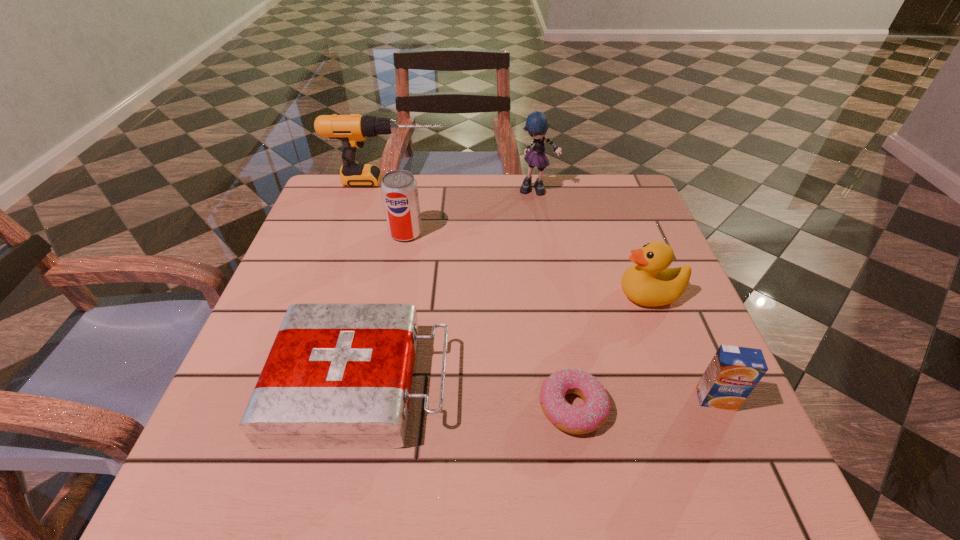
The width and height of the screenshot is (960, 540). I want to click on vacant space that is in between the drill and the rag doll, so click(463, 185).

This screenshot has width=960, height=540. What are the coordinates of `the fourth closest object to the doughnut` in the screenshot? It's located at (399, 189).

At what (x,y) coordinates should I click in order to perform the action: click on the sixth closest object to the first-aid kit. Please return your answer as a coordinate pair (x, y). This screenshot has width=960, height=540. Looking at the image, I should click on (352, 130).

What are the coordinates of `free spot that satisfies the following two spatial constraints: 1. at the beak of the fourth nearest object; 2. on the front side of the doughnut` in the screenshot? It's located at [x=693, y=408].

The width and height of the screenshot is (960, 540). I want to click on vacant space that satisfies the following two spatial constraints: 1. on the handle side of the drill; 2. on the back side of the soda, so click(373, 233).

This screenshot has width=960, height=540. I want to click on free spot that satisfies the following two spatial constraints: 1. on the back side of the shortest object; 2. on the right side of the orange_juice, so click(571, 399).

You are a GUI agent. You are given a task and a screenshot of the screen. Output one action in this format:
    pyautogui.click(x=<x>, y=<y>)
    Task: Click on the vacant space that satisfies the following two spatial constraints: 1. on the handle side of the drill; 2. on the right side of the soda
    
    Given the screenshot: What is the action you would take?
    click(373, 233)

The width and height of the screenshot is (960, 540). I want to click on vacant position in the image that satisfies the following two spatial constraints: 1. on the front side of the third shortest object; 2. on the left side of the first-aid kit, so tap(359, 399).

At what (x,y) coordinates should I click in order to perform the action: click on free space that satisfies the following two spatial constraints: 1. on the handle side of the fifth nearest object; 2. on the right side of the drill. Please return your answer as a coordinate pair (x, y). Image resolution: width=960 pixels, height=540 pixels. Looking at the image, I should click on click(x=373, y=233).

Identify the location of vacant region that satisfies the following two spatial constraints: 1. on the handle side of the fifth nearest object; 2. on the right side of the drill. The width and height of the screenshot is (960, 540). (373, 233).